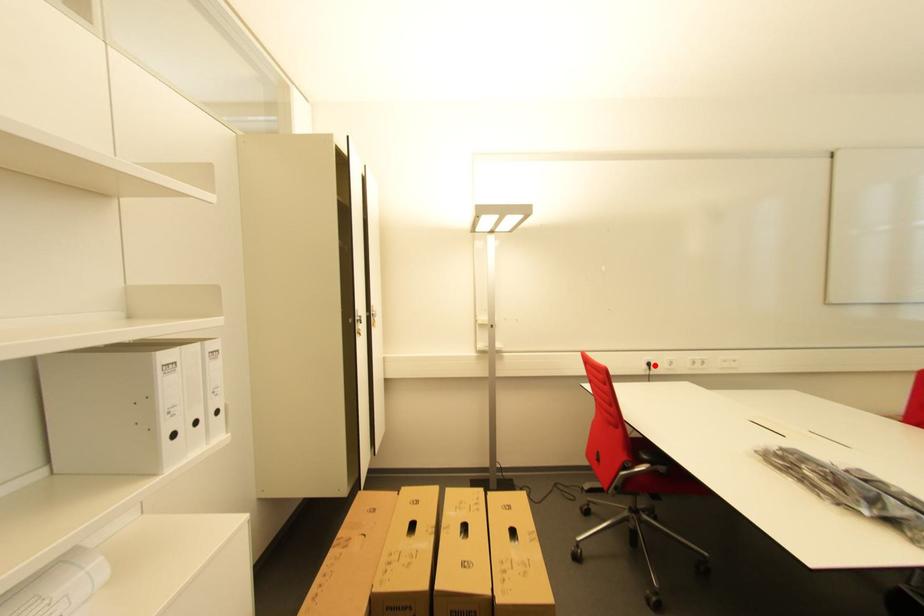
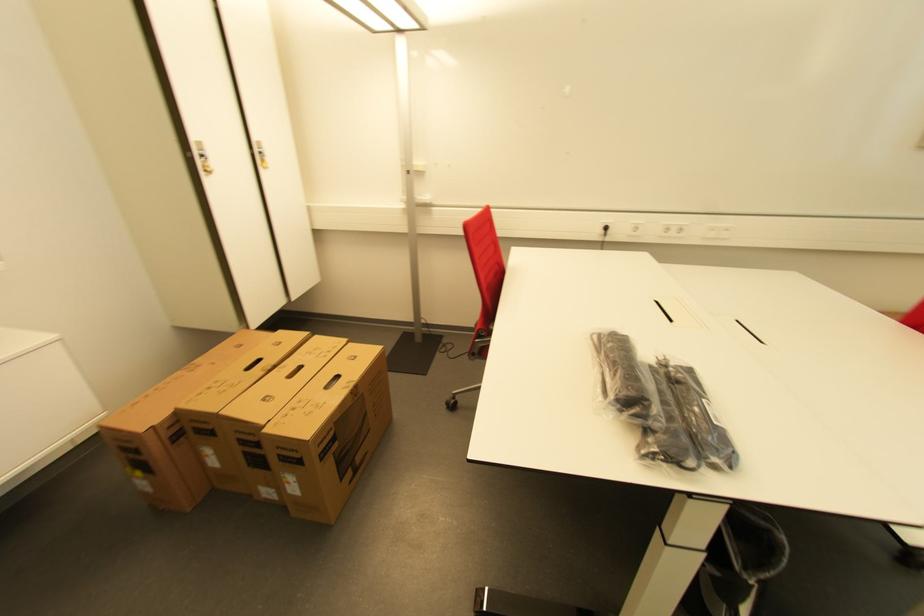
The point at the highlighted location is marked in the first image. Where is the corresponding point in the second image?

(611, 230)